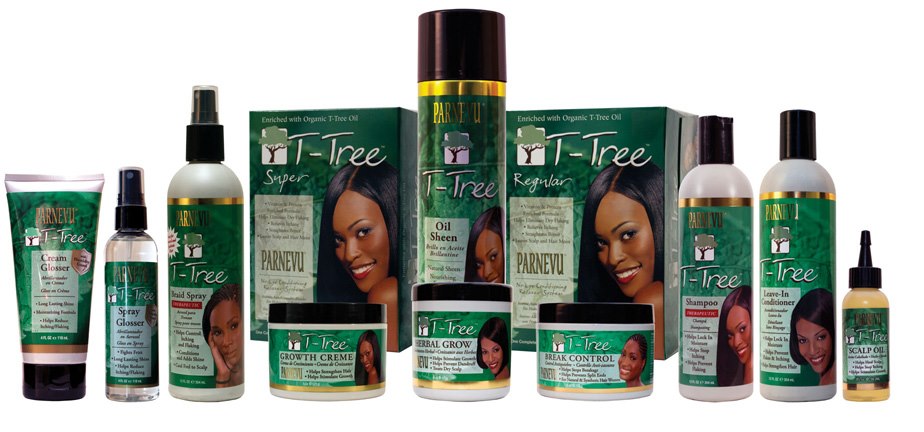
Identify the location of black lids on containers. click(119, 207), click(212, 142), click(326, 311), click(468, 291), click(440, 50), click(52, 390), click(602, 309), click(718, 135), click(813, 133), click(872, 279).